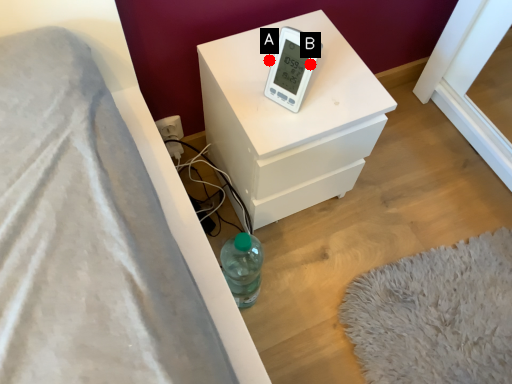
Question: Two points are circled on the image, labeled by A and B beside each circle. Which point is farther from the camera taking this photo?

Choices:
 (A) A is further
 (B) B is further

Answer: (A)